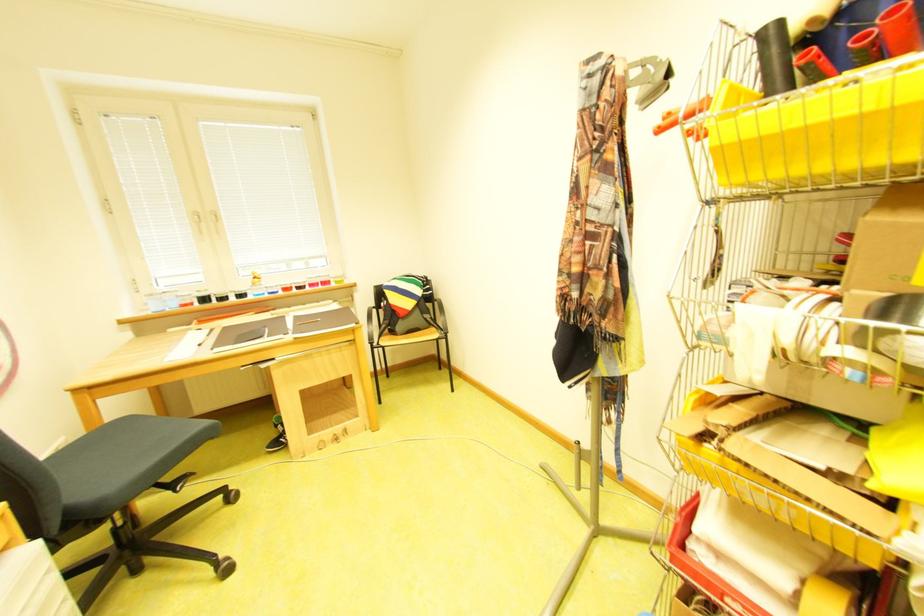
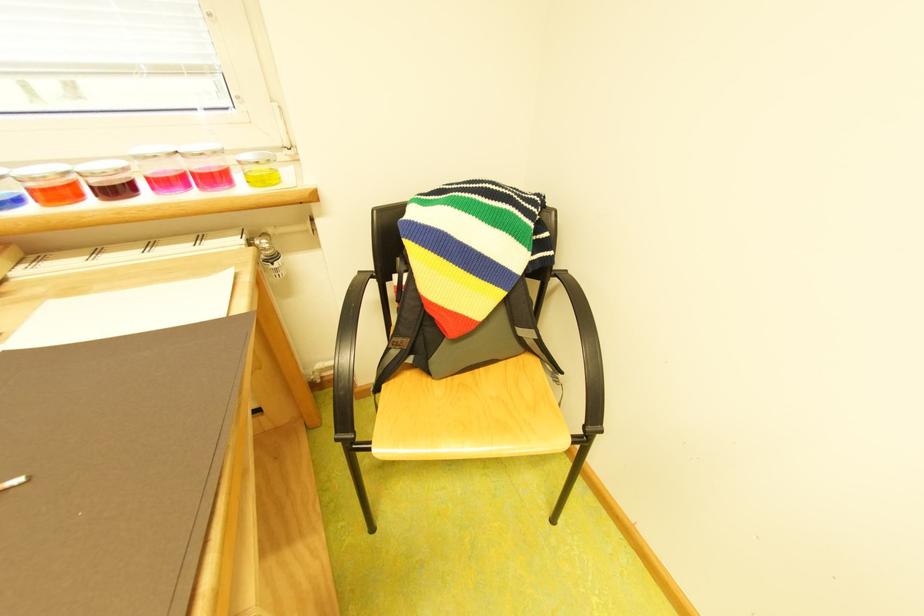
Locate, in the second image, the point that corresponds to point 288,286 in the first image.

(11, 180)